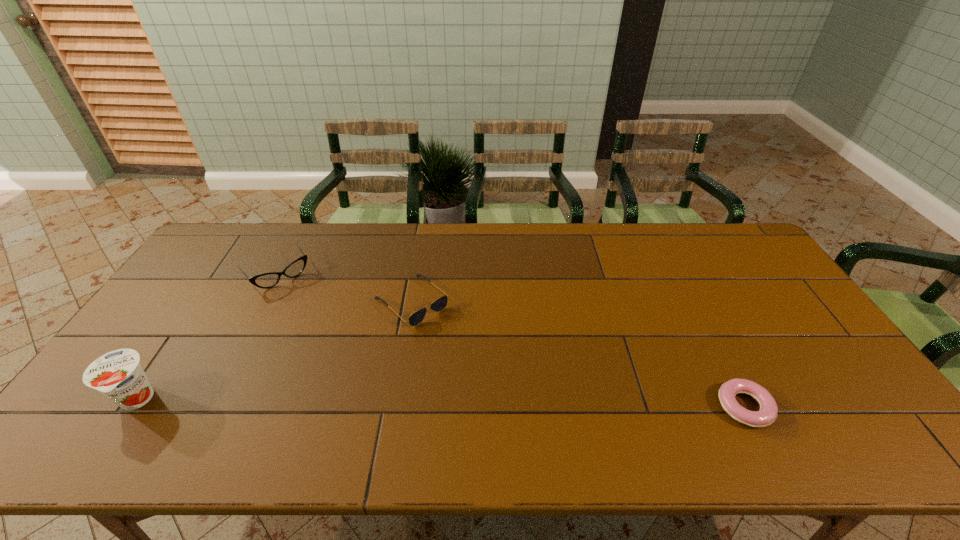
Find the location of a particular element. free space on the desktop that is between the yogurt and the rightmost object and is positioned on the front-facing side of the second object from right to left is located at coordinates pos(528,404).

This screenshot has height=540, width=960. I want to click on free space on the desktop that is between the leftmost object and the shortest object and is positioned on the front-facing side of the second tallest object, so click(375, 402).